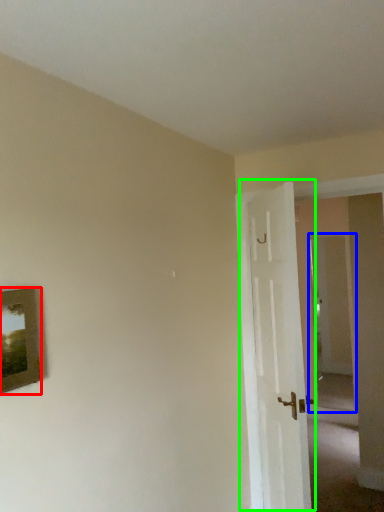
Question: Which object is positioned farthest from picture frame (highlighted by a red box)? Select from glass door (highlighted by a blue box) and door (highlighted by a green box).

Choices:
 (A) glass door
 (B) door

Answer: (A)